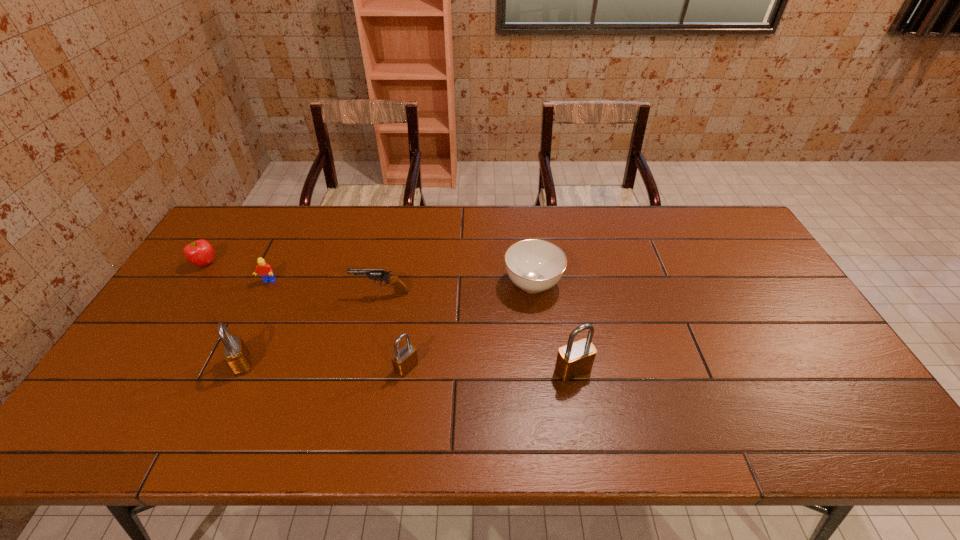
Identify the location of the second shortest padlock. (236, 355).

At what (x,y) coordinates should I click in order to perform the action: click on the sixth shortest object. Please return your answer as a coordinate pair (x, y). This screenshot has height=540, width=960. Looking at the image, I should click on pyautogui.click(x=236, y=355).

Locate an element on the screen. the shortest padlock is located at coordinates (403, 360).

Locate an element on the screen. the second padlock from right to left is located at coordinates (403, 360).

The width and height of the screenshot is (960, 540). I want to click on the rightmost padlock, so click(x=574, y=359).

I want to click on apple, so click(200, 253).

Where is `Lego`? Lego is located at coordinates (264, 269).

At what (x,y) coordinates should I click in order to perform the action: click on chinaware. Please return your answer as a coordinate pair (x, y). The height and width of the screenshot is (540, 960). Looking at the image, I should click on (533, 265).

Identify the location of gun. (400, 288).

The width and height of the screenshot is (960, 540). I want to click on vacant space situated 0.100m on the back of the second tallest object, so click(x=261, y=322).